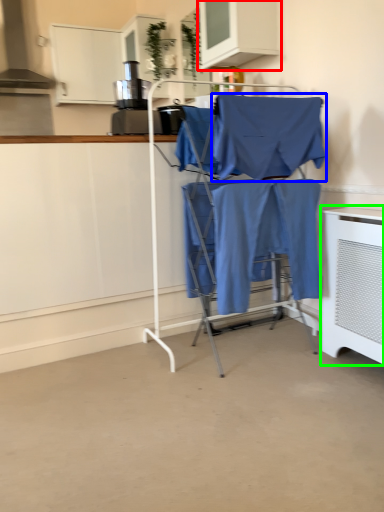
Question: Which object is the farthest from cabinetry (highlighted by a red box)? Choose among these: fabric (highlighted by a blue box) or home appliance (highlighted by a green box).

Choices:
 (A) fabric
 (B) home appliance

Answer: (B)